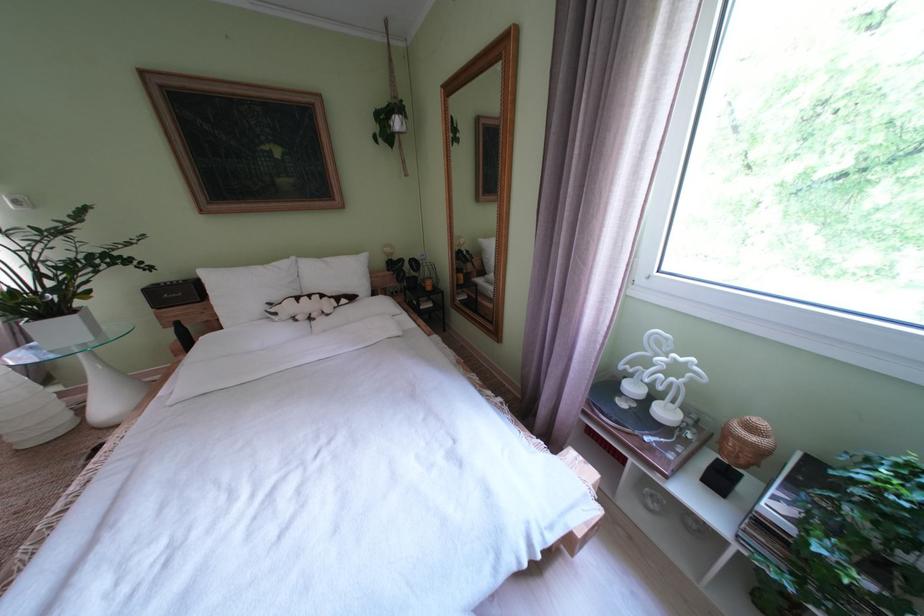
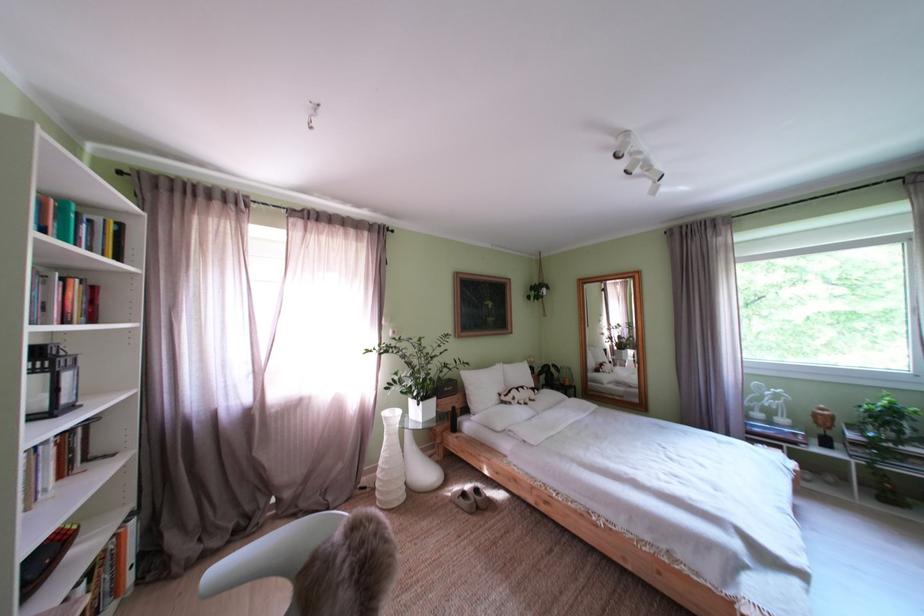
Find the pixel in the second image that matches [286,318] in the first image.

(525, 405)